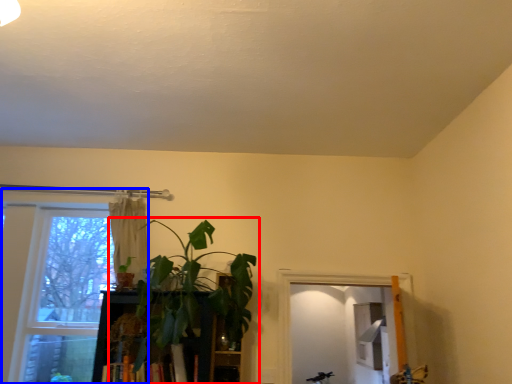
Question: Which point is closer to the camera, houseplant (highlighted by a red box) or window (highlighted by a blue box)?

Choices:
 (A) houseplant
 (B) window

Answer: (A)